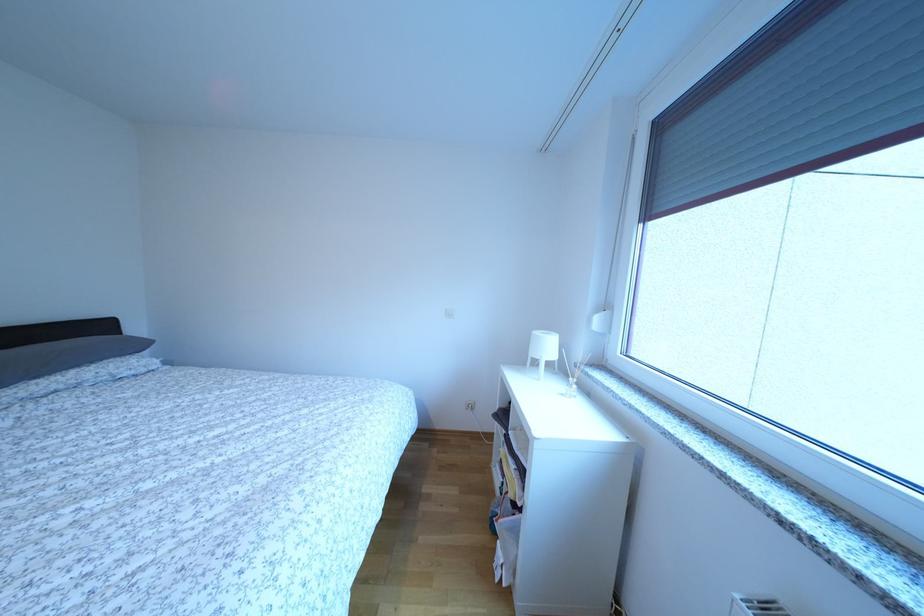
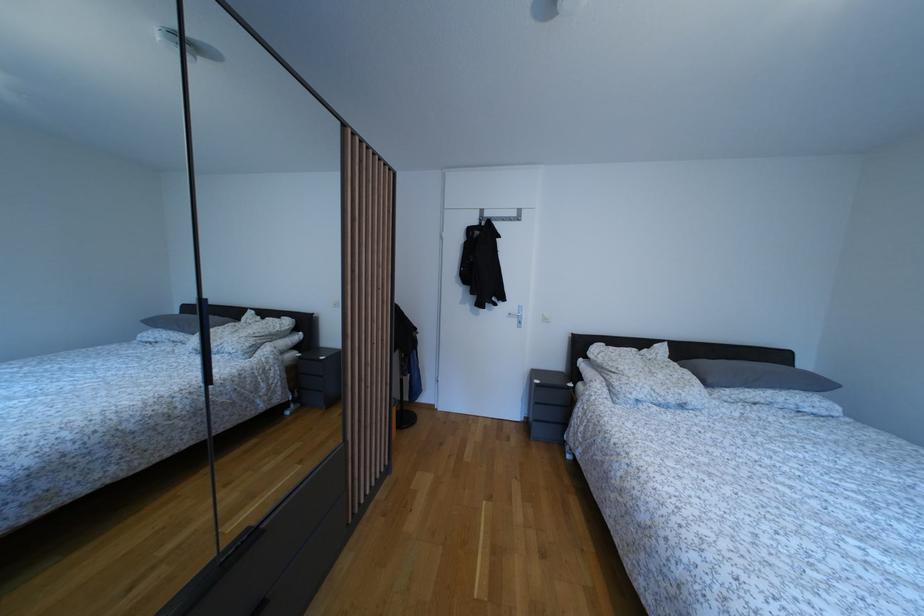
Question: The camera is either moving clockwise (left) or counter-clockwise (right) around the object. The first image is from the beginning of the video and the second image is from the end. Is the camera moving left or right when shooting the video?

Choices:
 (A) Left
 (B) Right

Answer: (B)